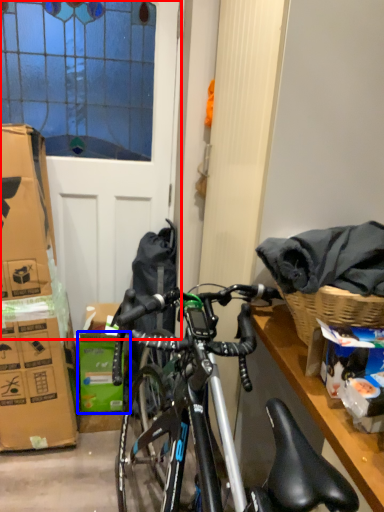
Question: Which of the following is the closest to the observer, screen door (highlighted by a red box) or box (highlighted by a blue box)?

Choices:
 (A) screen door
 (B) box

Answer: (A)